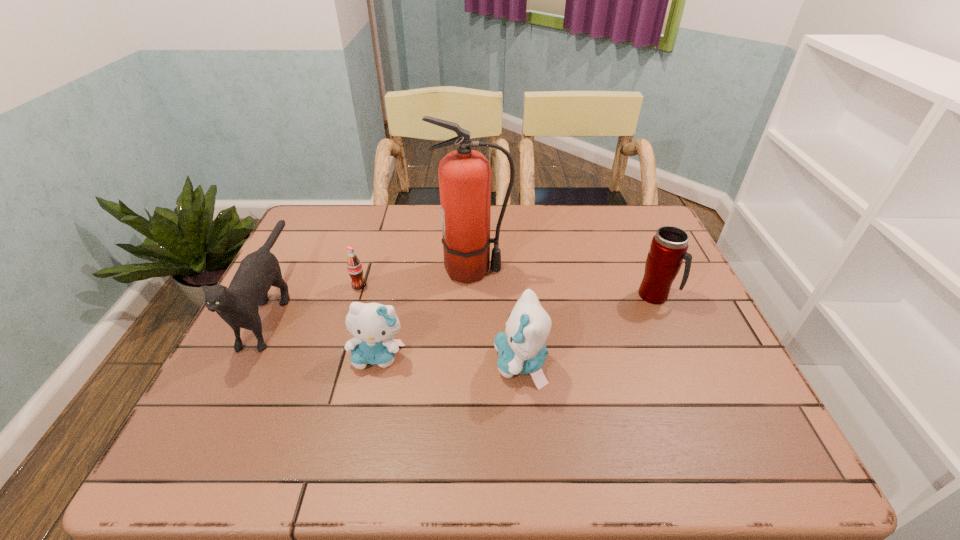
The kittens are evenly distributed in the image. To maintain this, where would you place another kitten on the right? Please point to a free space. Please provide its 2D coordinates. Your answer should be formatted as a tuple, i.e. [(x, y)], where the tuple contains the x and y coordinates of a point satisfying the conditions above.

[(668, 372)]